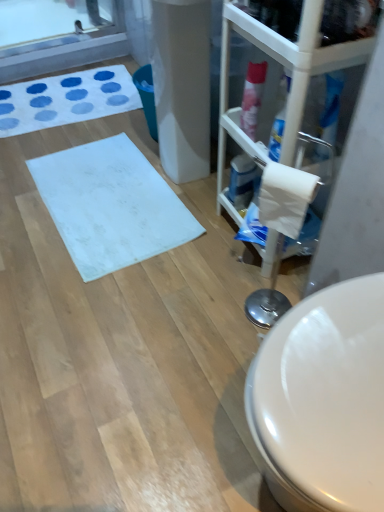
Question: From the image's perspective, is white matte toilet paper at right located above or below white matte bath mat at center, which is counted as the first bath mat, starting from the bottom?

Choices:
 (A) above
 (B) below

Answer: (B)

Question: Considering the positions of point (289, 200) and point (89, 185), is point (289, 200) closer or farther from the camera than point (89, 185)?

Choices:
 (A) closer
 (B) farther

Answer: (A)

Question: Based on their relative distances, which object is farther from the white matte toilet paper at right?

Choices:
 (A) white fabric bath mat at upper left, which is the 1th bath mat from back to front
 (B) white matte bath mat at center, which is counted as the second bath mat, starting from the top
 (C) transparent plastic glass door at right
 (D) blue glossy spray can at center-right, marked as the second cleaning product in a front-to-back arrangement
 (E) pink glossy spray can at upper right, the first cleaning product when ordered from front to back

Answer: (A)

Question: Which object is positioned farthest from the white matte bath mat at center, which is counted as the second bath mat, starting from the top?

Choices:
 (A) blue glossy spray can at center-right, which is the 2th cleaning product in top-to-bottom order
 (B) pink glossy spray can at upper right, positioned as the second cleaning product in back-to-front order
 (C) white matte toilet paper at right
 (D) transparent plastic glass door at right
 (E) white fabric bath mat at upper left, which ranks as the 2th bath mat in bottom-to-top order

Answer: (C)